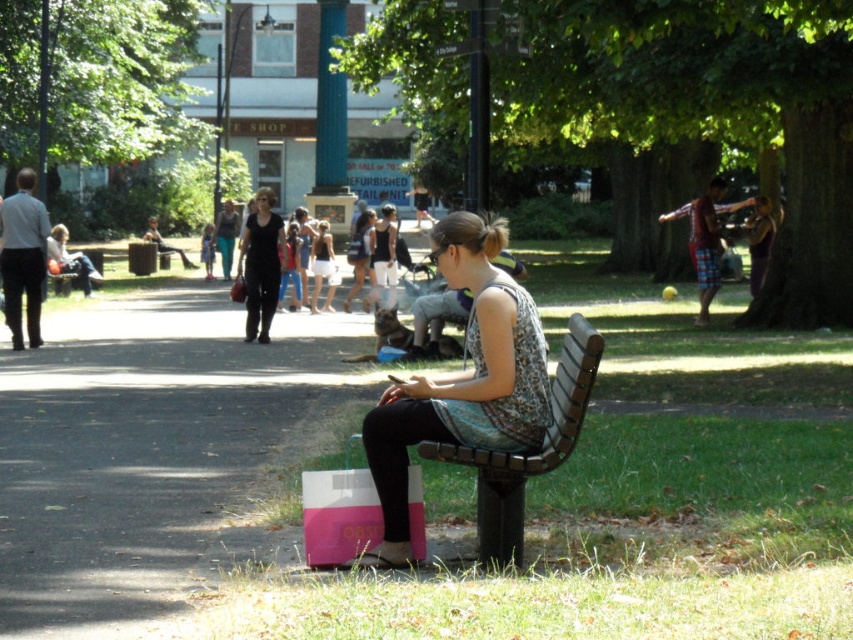
Does patterned fabric dress at center appear on the left side of white cotton dress at center?

In fact, patterned fabric dress at center is to the right of white cotton dress at center.

Does patterned fabric dress at center have a greater height compared to white cotton dress at center?

In fact, patterned fabric dress at center may be shorter than white cotton dress at center.

The width and height of the screenshot is (853, 640). What do you see at coordinates (462, 380) in the screenshot?
I see `patterned fabric dress at center` at bounding box center [462, 380].

At what (x,y) coordinates should I click in order to perform the action: click on patterned fabric dress at center. Please return your answer as a coordinate pair (x, y). Looking at the image, I should click on (462, 380).

Who is shorter, patterned fabric dress at center or pink matte shopping bag at lower center?

With less height is pink matte shopping bag at lower center.

Is point (374, 480) positioned after point (325, 516)?

No, (374, 480) is closer to viewer.

You are a GUI agent. You are given a task and a screenshot of the screen. Output one action in this format:
    pyautogui.click(x=<x>, y=<y>)
    Task: Click on the patterned fabric dress at center
    
    Given the screenshot: What is the action you would take?
    pyautogui.click(x=462, y=380)

Who is positioned more to the left, matte black dress at center or white cotton dress at center?

Positioned to the left is matte black dress at center.

Does matte black dress at center have a smaller size compared to white cotton dress at center?

No, matte black dress at center is not smaller than white cotton dress at center.

Which is behind, point (253, 323) or point (315, 284)?

Point (315, 284)

The image size is (853, 640). I want to click on matte black dress at center, so click(x=260, y=264).